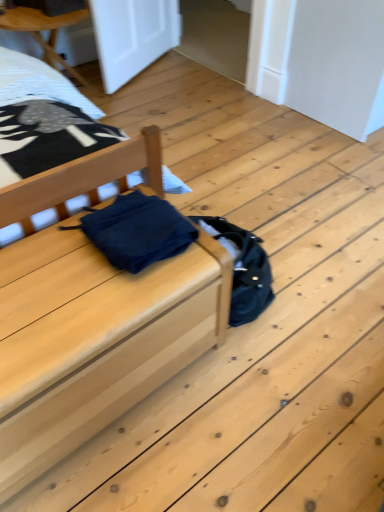
I want to click on vacant space to the left of dark blue fabric at center, so click(x=42, y=255).